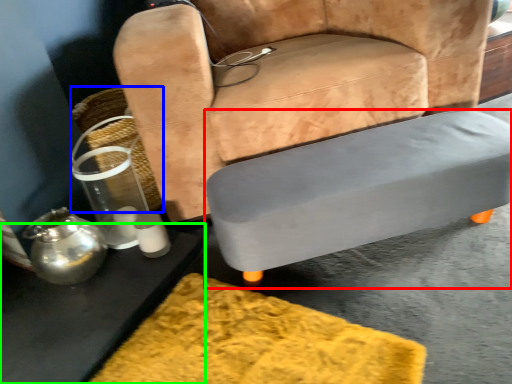
Question: Estimate the real-world distances between objects in this image. Which object is closer to table (highlighted by a red box), basket (highlighted by a blue box) or table (highlighted by a green box)?

Choices:
 (A) basket
 (B) table

Answer: (B)